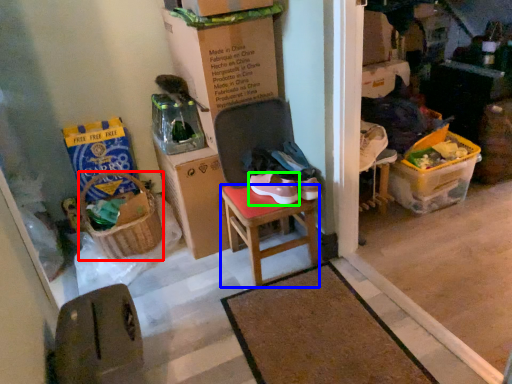
Question: Considering the real-world distances, which object is farthest from picnic basket (highlighted by a red box)? stool (highlighted by a blue box) or footwear (highlighted by a green box)?

Choices:
 (A) stool
 (B) footwear

Answer: (B)